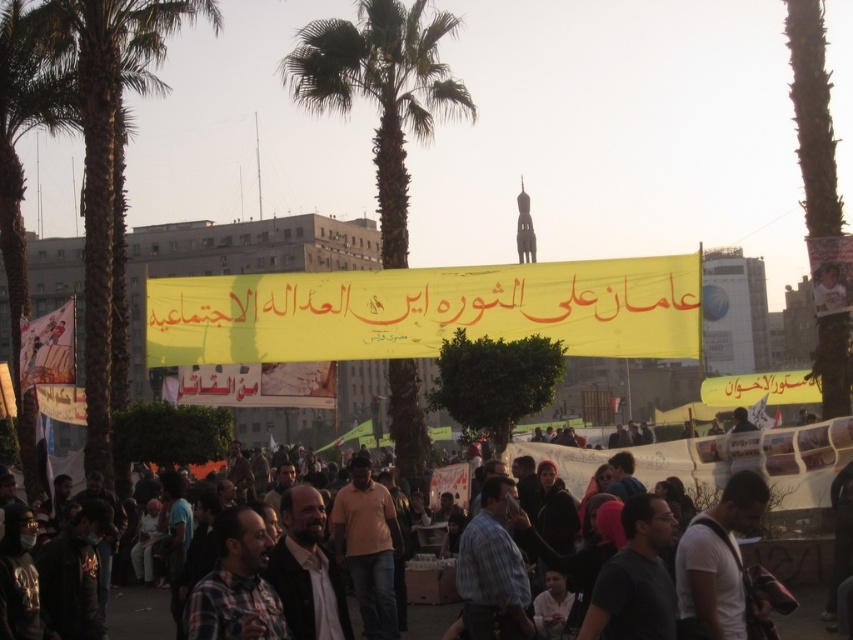
Question: Which of these objects is positioned farthest from the dark clothing crowd at center?

Choices:
 (A) yellow/yellowish paper at center
 (B) plaid shirt at center
 (C) green textured palm tree at left
 (D) orange matte shirt at center

Answer: (C)

Question: Can you confirm if orange matte shirt at center is positioned above dark clothing crowd at center?

Choices:
 (A) yes
 (B) no

Answer: (B)

Question: Can you confirm if white matte shirt at center is positioned above orange matte shirt at center?

Choices:
 (A) no
 (B) yes

Answer: (B)

Question: Can you confirm if plaid fabric shirt at center is smaller than plaid shirt at center?

Choices:
 (A) no
 (B) yes

Answer: (A)

Question: Among these points, which one is farthest from the camera?

Choices:
 (A) (383, 540)
 (B) (376, 13)
 (C) (231, 605)
 (D) (498, 637)

Answer: (B)

Question: Which point appears farthest from the camera in this image?

Choices:
 (A) (99, 227)
 (B) (369, 499)
 (C) (489, 522)

Answer: (A)